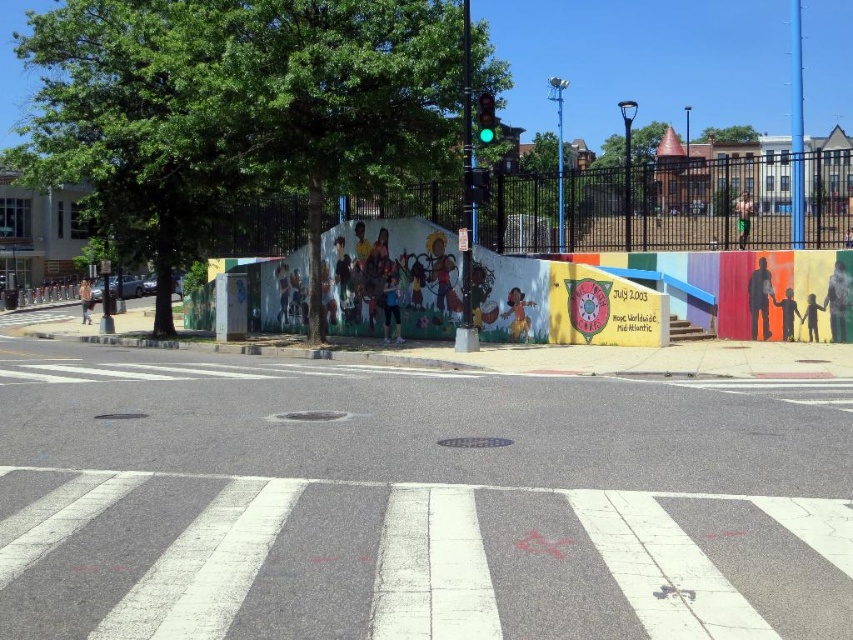
Who is taller, gray asphalt at center or green glass traffic light at upper center?

With more height is green glass traffic light at upper center.

Is point (380, 449) less distant than point (486, 140)?

Yes, point (380, 449) is closer to viewer.

Identify the location of gray asphalt at center. (410, 504).